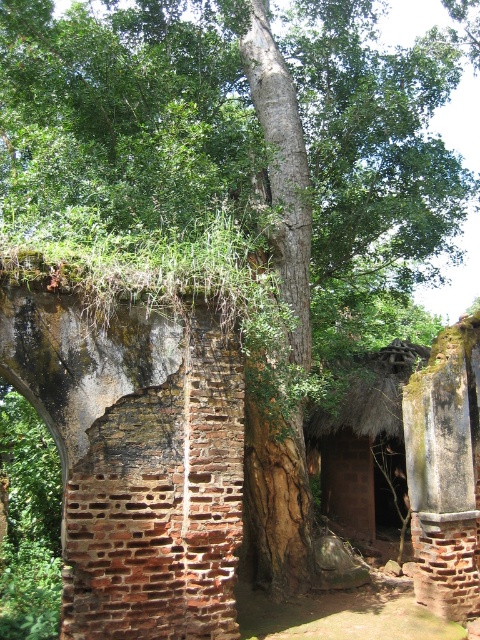
Question: Which object appears farthest from the camera in this image?

Choices:
 (A) thatched roof hut at center
 (B) rusty brick wall at center

Answer: (A)

Question: Considering the relative positions of rusty brick wall at center and thatched roof hut at center in the image provided, where is rusty brick wall at center located with respect to thatched roof hut at center?

Choices:
 (A) below
 (B) above

Answer: (B)

Question: Which of the following is the closest to the observer?

Choices:
 (A) thatched roof hut at center
 (B) rusty brick wall at center

Answer: (B)

Question: Is rusty brick wall at center thinner than thatched roof hut at center?

Choices:
 (A) yes
 (B) no

Answer: (A)

Question: Which point is closer to the camera?

Choices:
 (A) (323, 476)
 (B) (108, 532)

Answer: (B)

Question: Can you confirm if rusty brick wall at center is positioned above thatched roof hut at center?

Choices:
 (A) no
 (B) yes

Answer: (B)